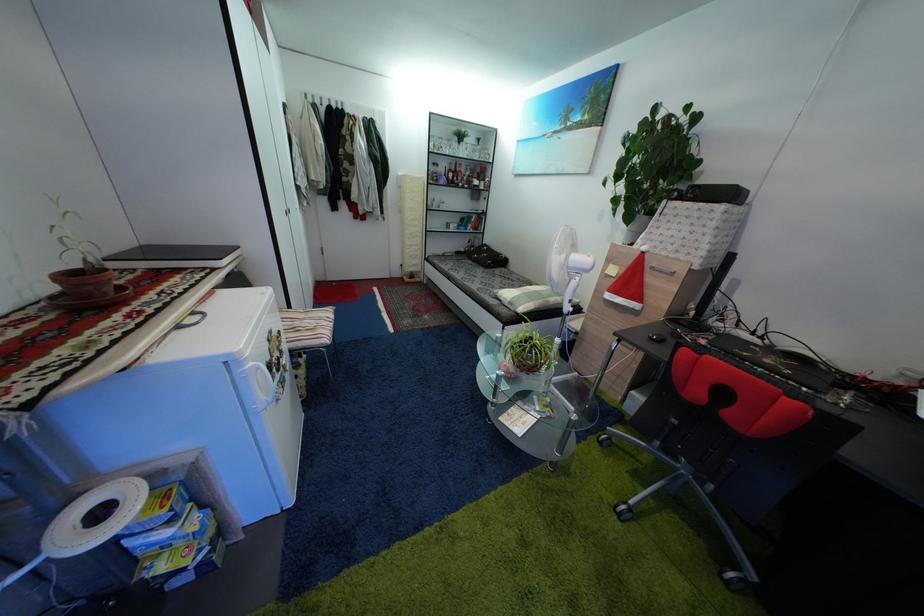
Find where to pull the cabinet drawer handle. Please return your answer as a coordinate pair (x, y).

(662, 270)